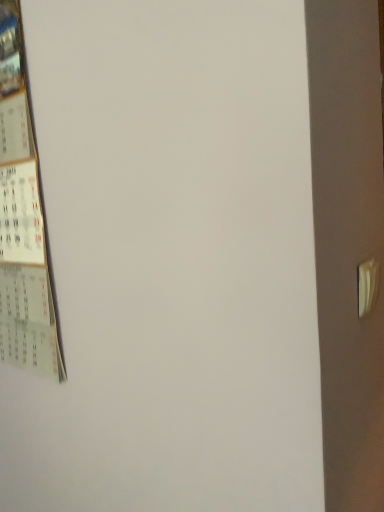
Question: From the image's perspective, does white paper calendar at left appear higher than white plastic door handle at right?

Choices:
 (A) no
 (B) yes

Answer: (B)

Question: Is white paper calendar at left at the left side of white plastic door handle at right?

Choices:
 (A) yes
 (B) no

Answer: (A)

Question: Does white paper calendar at left come behind white plastic door handle at right?

Choices:
 (A) no
 (B) yes

Answer: (B)

Question: Can we say white paper calendar at left lies outside white plastic door handle at right?

Choices:
 (A) yes
 (B) no

Answer: (A)

Question: Is white paper calendar at left positioned with its back to white plastic door handle at right?

Choices:
 (A) yes
 (B) no

Answer: (B)

Question: Does white paper calendar at left have a smaller size compared to white plastic door handle at right?

Choices:
 (A) no
 (B) yes

Answer: (A)

Question: Is white plastic door handle at right at the right side of white paper calendar at left?

Choices:
 (A) yes
 (B) no

Answer: (A)

Question: Is white plastic door handle at right in front of white paper calendar at left?

Choices:
 (A) no
 (B) yes

Answer: (B)

Question: From the image's perspective, is white plastic door handle at right on top of white paper calendar at left?

Choices:
 (A) yes
 (B) no

Answer: (B)

Question: Can you confirm if white plastic door handle at right is positioned to the left of white paper calendar at left?

Choices:
 (A) no
 (B) yes

Answer: (A)

Question: Does white plastic door handle at right have a lesser height compared to white paper calendar at left?

Choices:
 (A) yes
 (B) no

Answer: (A)

Question: Considering the relative positions of white plastic door handle at right and white paper calendar at left in the image provided, is white plastic door handle at right behind white paper calendar at left?

Choices:
 (A) yes
 (B) no

Answer: (B)

Question: Is white plastic door handle at right situated inside white paper calendar at left or outside?

Choices:
 (A) outside
 (B) inside

Answer: (A)